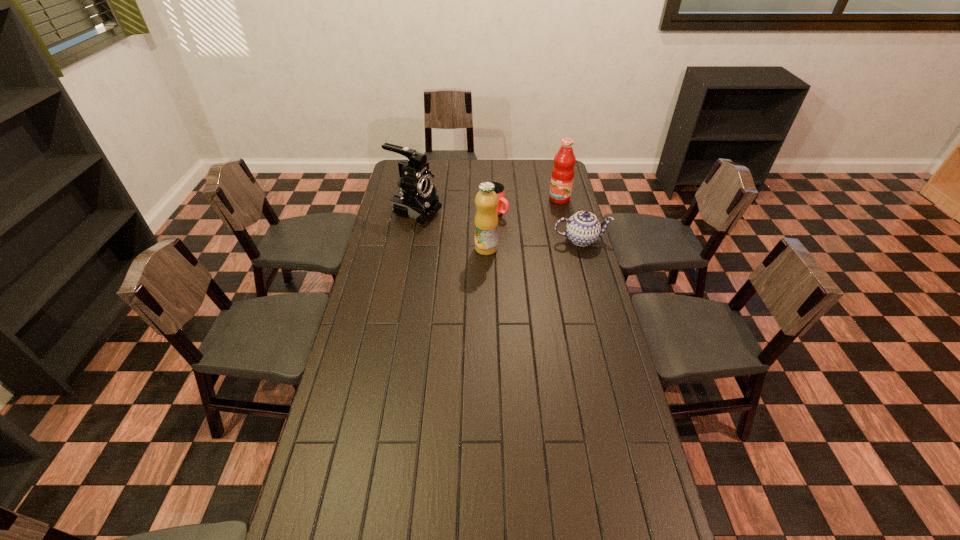
What are the coordinates of `free space at the right edge of the desktop` in the screenshot? It's located at (550, 247).

The image size is (960, 540). In the image, there is a desktop. Identify the location of free space at the far right corner. (548, 173).

Image resolution: width=960 pixels, height=540 pixels. Identify the location of unoccupied area between the left fruit juice and the chinaware. (534, 244).

The width and height of the screenshot is (960, 540). In order to click on unoccupied area between the camcorder and the left fruit juice in this screenshot , I will do `click(450, 230)`.

This screenshot has height=540, width=960. I want to click on free space between the cup and the chinaware, so click(538, 226).

At what (x,y) coordinates should I click in order to perform the action: click on free space between the camcorder and the chinaware. Please return your answer as a coordinate pair (x, y). Looking at the image, I should click on (498, 226).

Image resolution: width=960 pixels, height=540 pixels. Identify the location of the third closest object to the right fruit juice. (486, 219).

Find the location of a particular element. This screenshot has width=960, height=540. object that is the fourth nearest to the leftmost object is located at coordinates (562, 177).